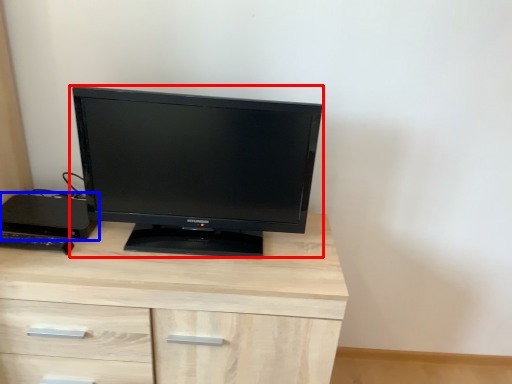
Question: Among these objects, which one is farthest to the camera, computer monitor (highlighted by a red box) or desktop (highlighted by a blue box)?

Choices:
 (A) computer monitor
 (B) desktop

Answer: (B)